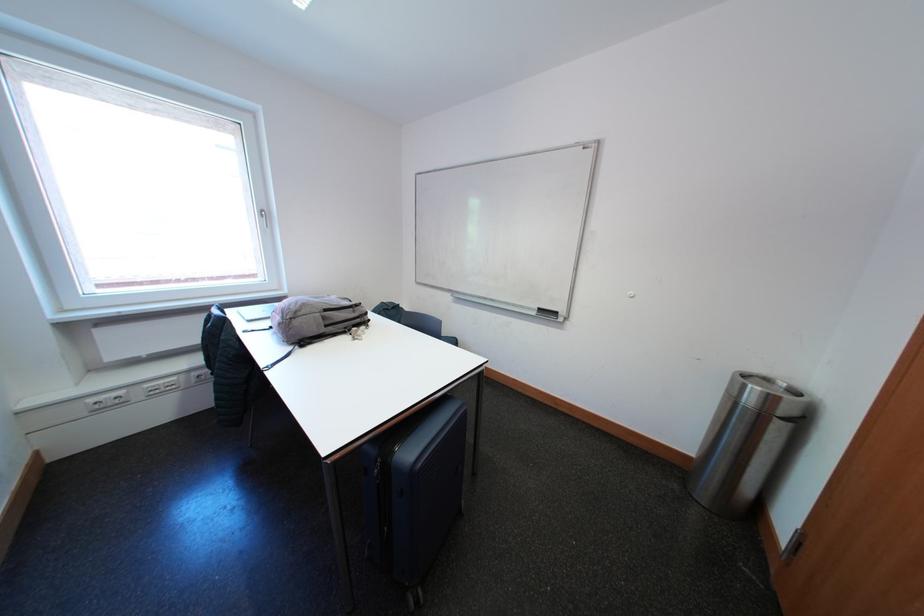
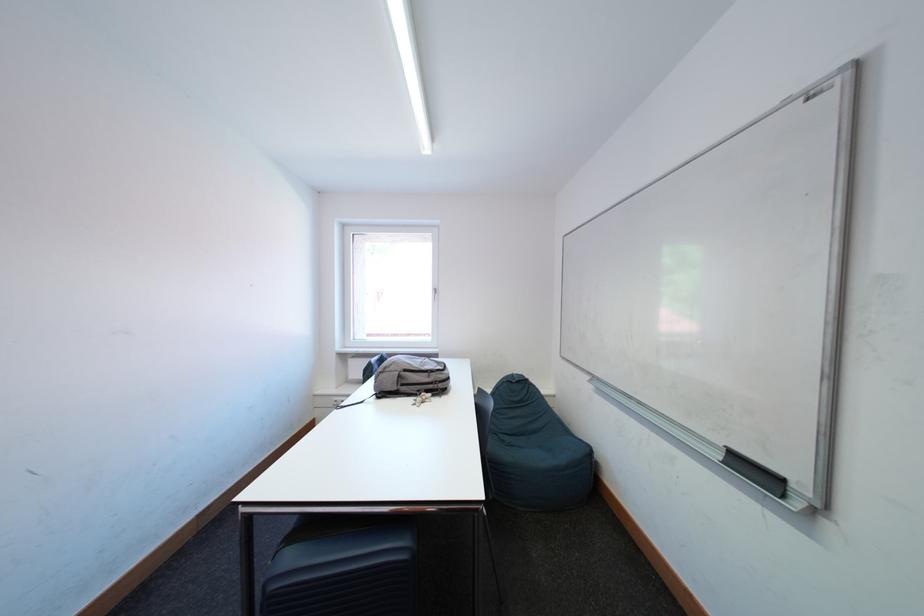
Question: How did the camera likely rotate?

Choices:
 (A) Left
 (B) Right
 (C) Up
 (D) Down

Answer: (A)